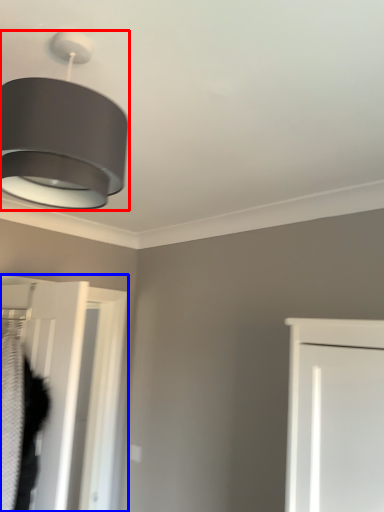
Question: Which point is closer to the camera, lamp (highlighted by a red box) or door (highlighted by a blue box)?

Choices:
 (A) lamp
 (B) door

Answer: (A)